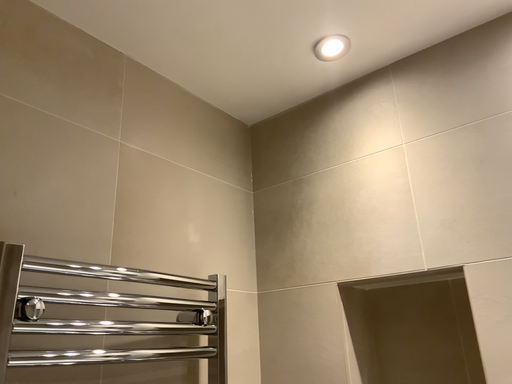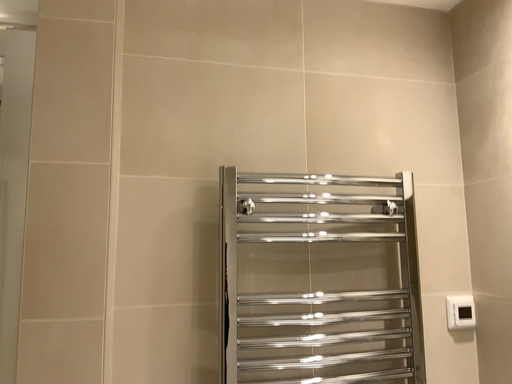
Question: How did the camera likely rotate when shooting the video?

Choices:
 (A) rotated upward
 (B) rotated downward

Answer: (B)